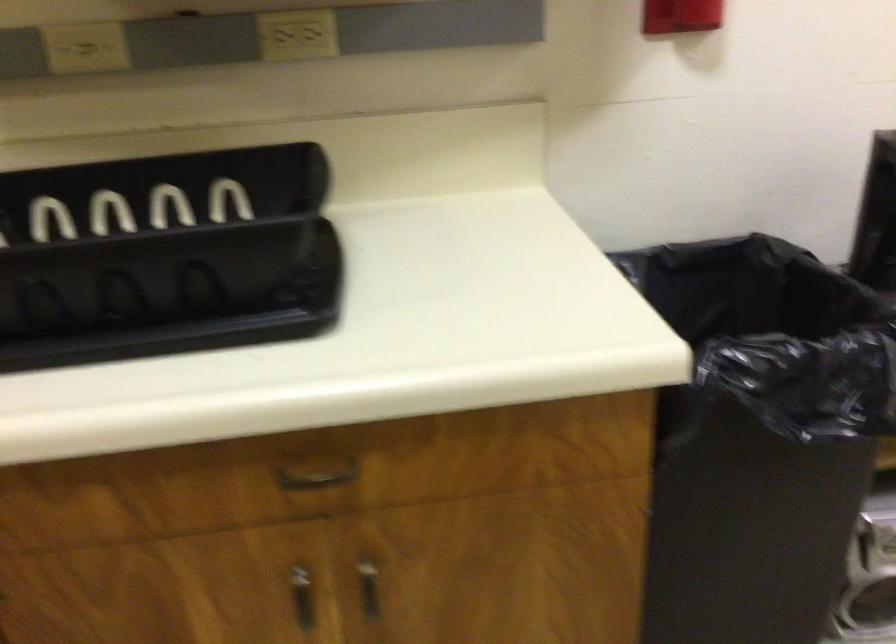
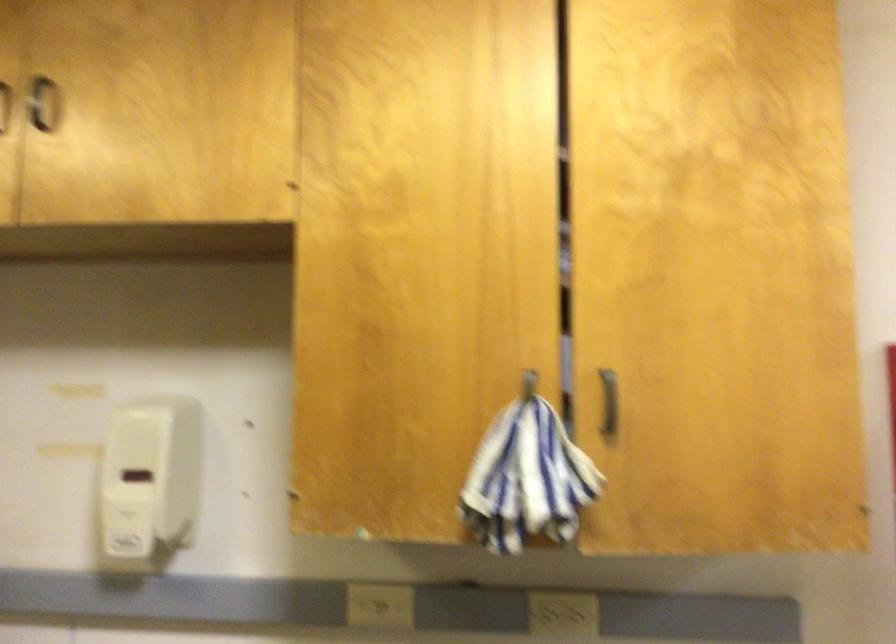
The images are taken continuously from a first-person perspective. In which direction is your viewpoint rotating?

The camera's rotation is toward left-up.